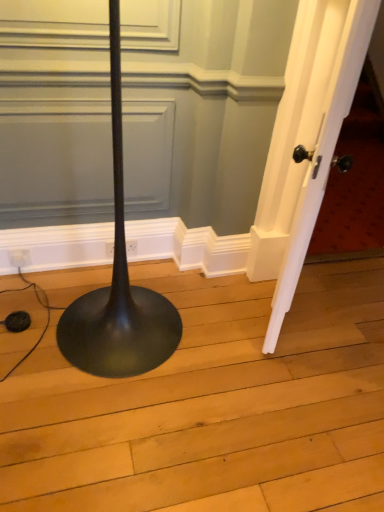
Locate an element on the screen. The image size is (384, 512). free space underneath white wooden door at right (from a real-world perspective) is located at coordinates (266, 316).